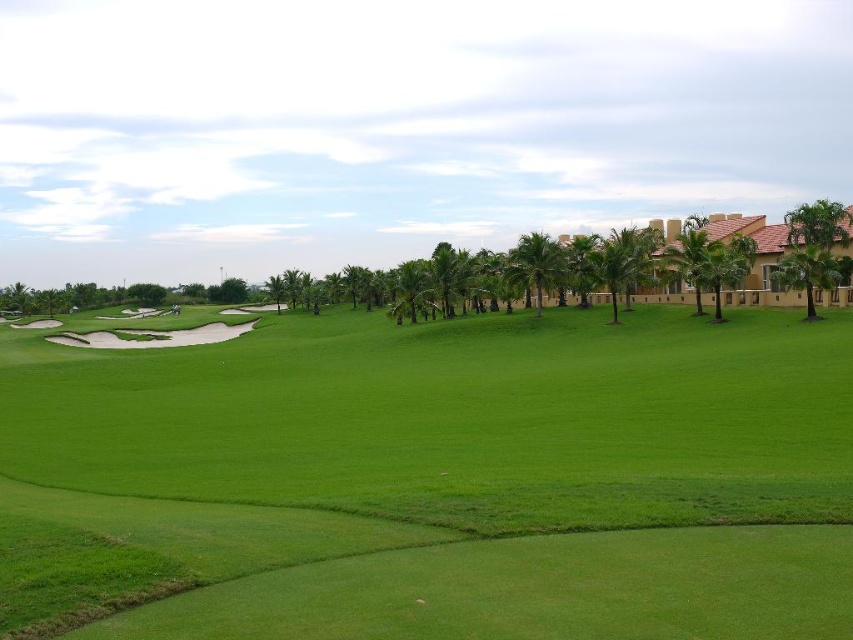
Question: Which object appears farthest from the camera in this image?

Choices:
 (A) green leafy palm tree at center
 (B) green grassy field at center
 (C) green leafy palm tree at right

Answer: (A)

Question: Which object appears closest to the camera in this image?

Choices:
 (A) green grassy field at center
 (B) green leafy palm tree at center-right
 (C) green leafy palm tree at right

Answer: (A)

Question: Can you confirm if green leafy palm tree at right is thinner than green leafy palm tree at center?

Choices:
 (A) yes
 (B) no

Answer: (B)

Question: Can you confirm if green leafy palm tree at center-right is positioned below green leafy palm tree at center?

Choices:
 (A) no
 (B) yes

Answer: (B)

Question: Which object is closer to the camera taking this photo?

Choices:
 (A) green grassy field at center
 (B) green leafy palm tree at right

Answer: (A)

Question: Is green grassy field at center above green leafy palm tree at center?

Choices:
 (A) yes
 (B) no

Answer: (B)